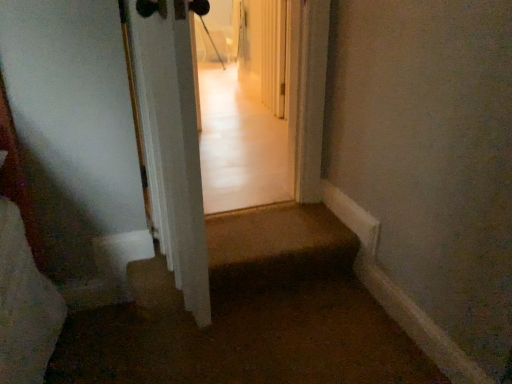
The height and width of the screenshot is (384, 512). Describe the element at coordinates (249, 315) in the screenshot. I see `brown carpet at lower center` at that location.

Identify the location of brown carpet at lower center. [x=249, y=315].

What is the approximate height of white glossy door at center?

It is 3.32 feet.

Describe the element at coordinates (172, 145) in the screenshot. I see `white glossy door at center` at that location.

What is the approximate width of white glossy door at center?

It is 7.77 inches.

Locate an element on the screen. This screenshot has height=384, width=512. white glossy door at center is located at coordinates (172, 145).

The width and height of the screenshot is (512, 384). Find the location of `brown carpet at lower center`. brown carpet at lower center is located at coordinates (249, 315).

Can you confirm if white glossy door at center is positioned to the right of brown carpet at lower center?

No.

Is white glossy door at center closer to camera compared to brown carpet at lower center?

That is True.

Which is in front, point (153, 158) or point (106, 367)?

The point (106, 367) is more forward.

From the image's perspective, would you say white glossy door at center is shown under brown carpet at lower center?

Incorrect, from the image's perspective, white glossy door at center is higher than brown carpet at lower center.

From a real-world perspective, which object rests below the other?

In real-world perspective, brown carpet at lower center is lower.

Considering the relative sizes of white glossy door at center and brown carpet at lower center in the image provided, is white glossy door at center wider than brown carpet at lower center?

Incorrect, the width of white glossy door at center does not surpass that of brown carpet at lower center.

Considering the relative sizes of white glossy door at center and brown carpet at lower center in the image provided, is white glossy door at center shorter than brown carpet at lower center?

Incorrect, the height of white glossy door at center does not fall short of that of brown carpet at lower center.

Which of these two, white glossy door at center or brown carpet at lower center, is smaller?

With smaller size is white glossy door at center.

Is white glossy door at center positioned beyond the bounds of brown carpet at lower center?

white glossy door at center lies outside brown carpet at lower center's area.

Is white glossy door at center directly adjacent to brown carpet at lower center?

No, white glossy door at center is not with brown carpet at lower center.

Could you tell me if white glossy door at center is turned towards brown carpet at lower center?

No, white glossy door at center is not turned towards brown carpet at lower center.

This screenshot has height=384, width=512. Find the location of `corridor below the white glossy door at center (from a real-world perspective)`. corridor below the white glossy door at center (from a real-world perspective) is located at coordinates (249, 315).

Based on their positions, is brown carpet at lower center located to the left or right of white glossy door at center?

Clearly, brown carpet at lower center is on the right of white glossy door at center in the image.

Is the position of brown carpet at lower center more distant than that of white glossy door at center?

Yes, it is behind white glossy door at center.

In the scene shown: Which point is more distant from viewer, (344, 334) or (166, 257)?

The point (166, 257) is more distant.

From the image's perspective, is brown carpet at lower center located above white glossy door at center?

No, from the image's perspective, brown carpet at lower center is not over white glossy door at center.

From a real-world perspective, does brown carpet at lower center stand above white glossy door at center?

Actually, brown carpet at lower center is physically below white glossy door at center in the real world.

Does brown carpet at lower center have a greater width compared to white glossy door at center?

Yes.

Can you confirm if brown carpet at lower center is taller than white glossy door at center?

No, brown carpet at lower center is not taller than white glossy door at center.

From the picture: Which of these two, brown carpet at lower center or white glossy door at center, is bigger?

Bigger between the two is brown carpet at lower center.

Is white glossy door at center a part of brown carpet at lower center?

Actually, white glossy door at center is outside brown carpet at lower center.

Are brown carpet at lower center and white glossy door at center beside each other?

They are not placed beside each other.

Is brown carpet at lower center oriented towards white glossy door at center?

No.

What's the angular difference between brown carpet at lower center and white glossy door at center's facing directions?

brown carpet at lower center and white glossy door at center are facing 95.8 degrees away from each other.

The height and width of the screenshot is (384, 512). Identify the location of door lying in front of the brown carpet at lower center. (172, 145).

I want to click on door above the brown carpet at lower center (from the image's perspective), so click(x=172, y=145).

You are a GUI agent. You are given a task and a screenshot of the screen. Output one action in this format:
    pyautogui.click(x=<x>, y=<y>)
    Task: Click on the door that is above the brown carpet at lower center (from a real-world perspective)
    This screenshot has width=512, height=384.
    Given the screenshot: What is the action you would take?
    pyautogui.click(x=172, y=145)